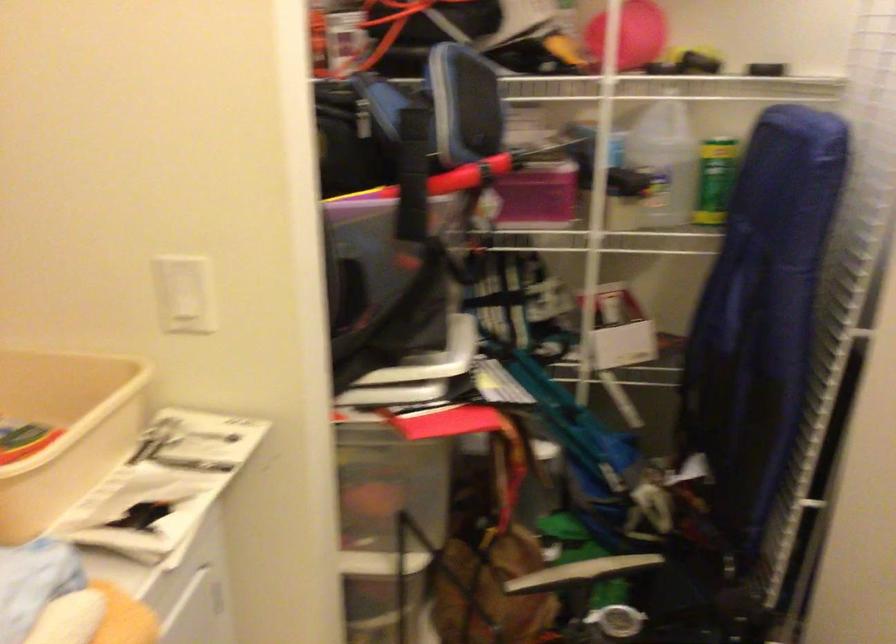
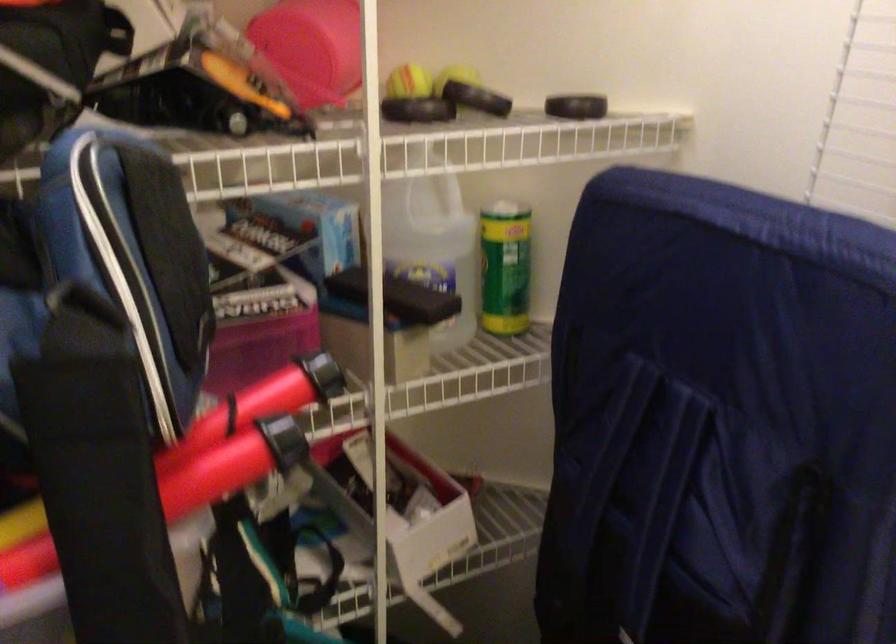
Where in the second image is the point corresponding to the point at 480,164 from the first image?

(282, 440)